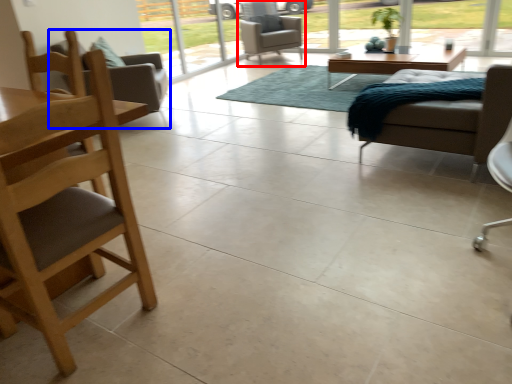
Question: Which point is closer to the camera, chair (highlighted by a red box) or chair (highlighted by a blue box)?

Choices:
 (A) chair
 (B) chair

Answer: (B)